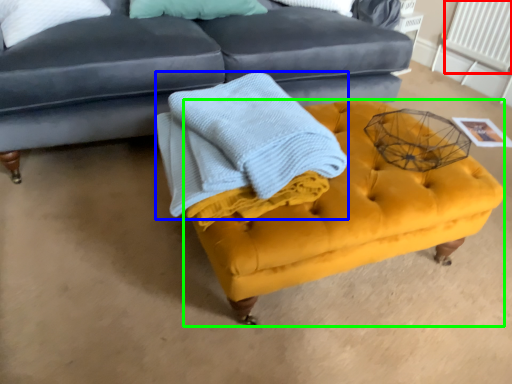
Question: Which is farther away from radiator (highlighted by a red box)? blanket (highlighted by a blue box) or swivel chair (highlighted by a green box)?

Choices:
 (A) blanket
 (B) swivel chair

Answer: (A)